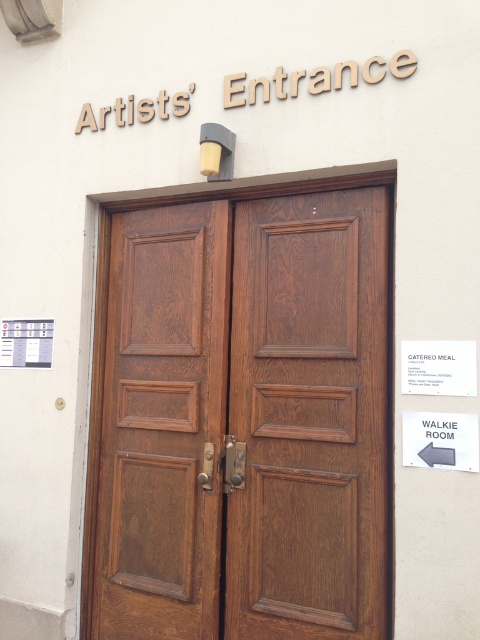
Question: Does brown wood door at center appear over white paperboard at upper left?

Choices:
 (A) yes
 (B) no

Answer: (B)

Question: Can you confirm if wooden door at center is positioned above white paperboard at upper left?

Choices:
 (A) no
 (B) yes

Answer: (A)

Question: Estimate the real-world distances between objects in this image. Which object is closer to the brown wood door at center?

Choices:
 (A) white paperboard at upper left
 (B) wooden door at center

Answer: (B)

Question: Estimate the real-world distances between objects in this image. Which object is closer to the brown wood door at center?

Choices:
 (A) wooden door at center
 (B) white paperboard at upper left

Answer: (A)

Question: Observing the image, what is the correct spatial positioning of brown wood door at center in reference to wooden door at center?

Choices:
 (A) right
 (B) left

Answer: (A)

Question: Which object is farther from the camera taking this photo?

Choices:
 (A) wooden door at center
 (B) white paperboard at upper left
 (C) brown wood door at center

Answer: (B)